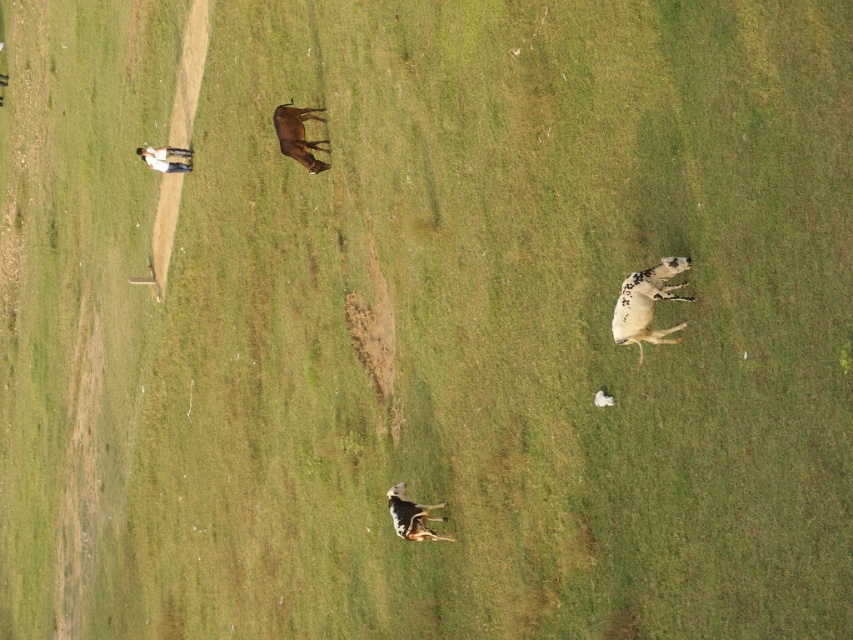
You are a farmer looking at the field from the shelter. You see the brown glossy cow at upper center and the white glossy cow at upper left. Which cow is closer to the shelter?

The white glossy cow at upper left is closer to the shelter because it is positioned above the brown glossy cow at upper center, which is below it.

You are a farmer who needs to check on the animals in the field. You are currently standing next to the shelter in the upper left corner. You see the white speckled fur at lower right and the brown glossy cow at upper center. Which cow is farther away from your current position?

The white speckled fur at lower right is farther away from your current position because it is located at the lower right of the field, while the brown glossy cow at upper center is closer to the upper left corner where you are standing.

You are a farmer checking the field. You notice the white speckled fur at lower right and the spotted fur cow at center. Which cow is smaller in size?

The white speckled fur at lower right is smaller in size compared to the spotted fur cow at center.